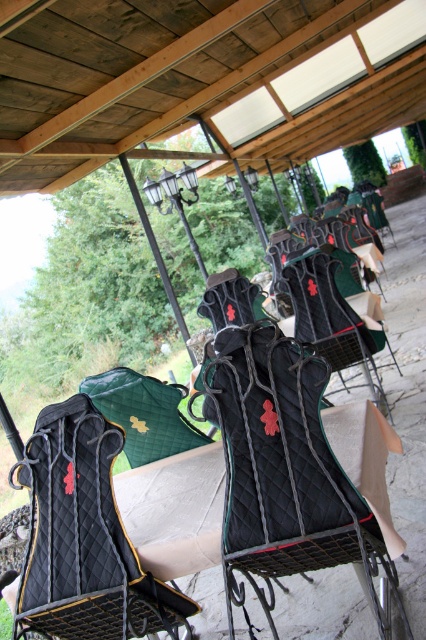
Question: Which point is farther from the camera taking this photo?

Choices:
 (A) (362, 365)
 (B) (186, 604)

Answer: (A)

Question: Considering the real-world distances, which object is farthest from the black quilted folding chair at center?

Choices:
 (A) quilted black chair at center
 (B) black quilted table at center

Answer: (A)

Question: Can you confirm if black quilted folding chair at center is positioned above quilted black chair at center?

Choices:
 (A) no
 (B) yes

Answer: (A)

Question: Can you confirm if black quilted folding chair at center is positioned below black quilted table at center?

Choices:
 (A) no
 (B) yes

Answer: (B)

Question: Does black quilted folding chair at center come behind black quilted table at center?

Choices:
 (A) no
 (B) yes

Answer: (A)

Question: Which point is closer to the camera?

Choices:
 (A) black quilted table at center
 (B) quilted black chair at center

Answer: (A)